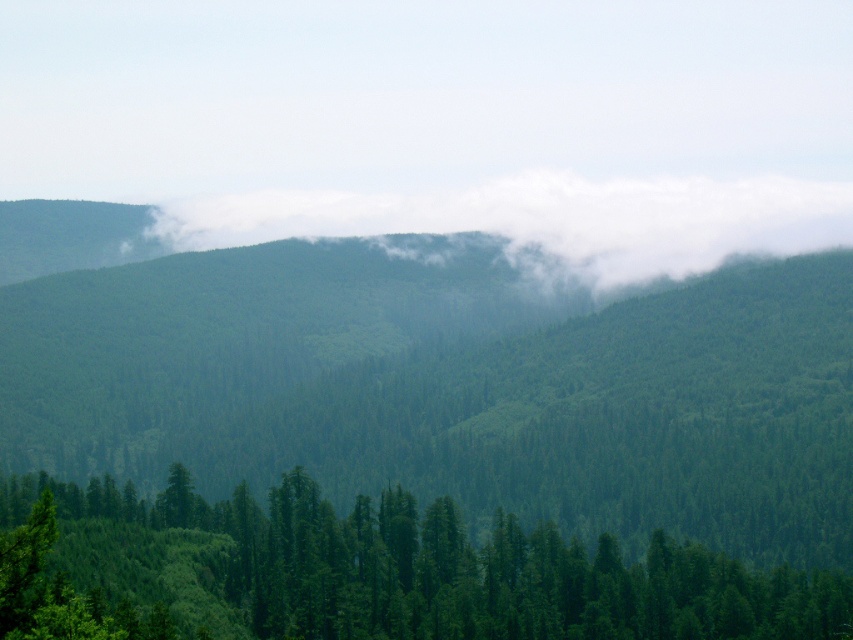
Question: Is green matte tree at lower left closer to the viewer compared to white fluffy cloud at center?

Choices:
 (A) yes
 (B) no

Answer: (A)

Question: Which object appears farthest from the camera in this image?

Choices:
 (A) green matte tree at lower left
 (B) white fluffy cloud at center

Answer: (B)

Question: From the image, what is the correct spatial relationship of green matte tree at lower left in relation to white fluffy cloud at center?

Choices:
 (A) above
 (B) below

Answer: (B)

Question: Which of the following is the closest to the observer?

Choices:
 (A) (56, 484)
 (B) (434, 205)

Answer: (A)

Question: From the image, what is the correct spatial relationship of green matte tree at lower left in relation to white fluffy cloud at center?

Choices:
 (A) right
 (B) left

Answer: (B)